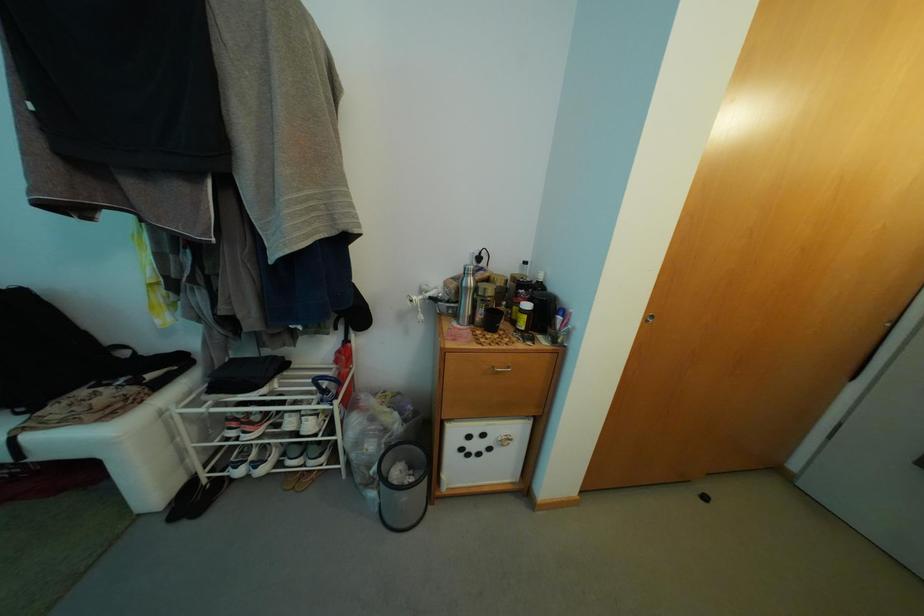
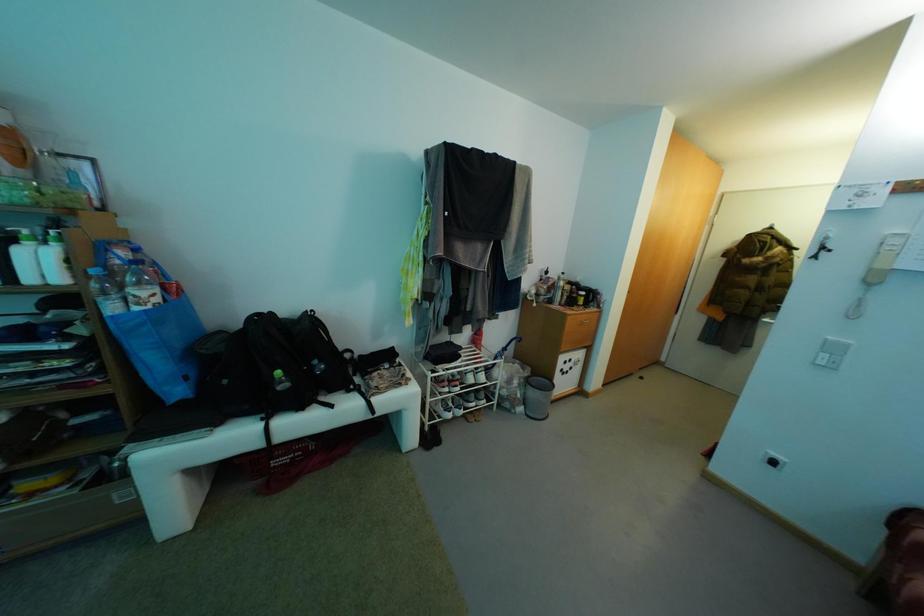
The images are taken continuously from a first-person perspective. In which direction are you moving?

The movement direction of the cameraman is left, backward.